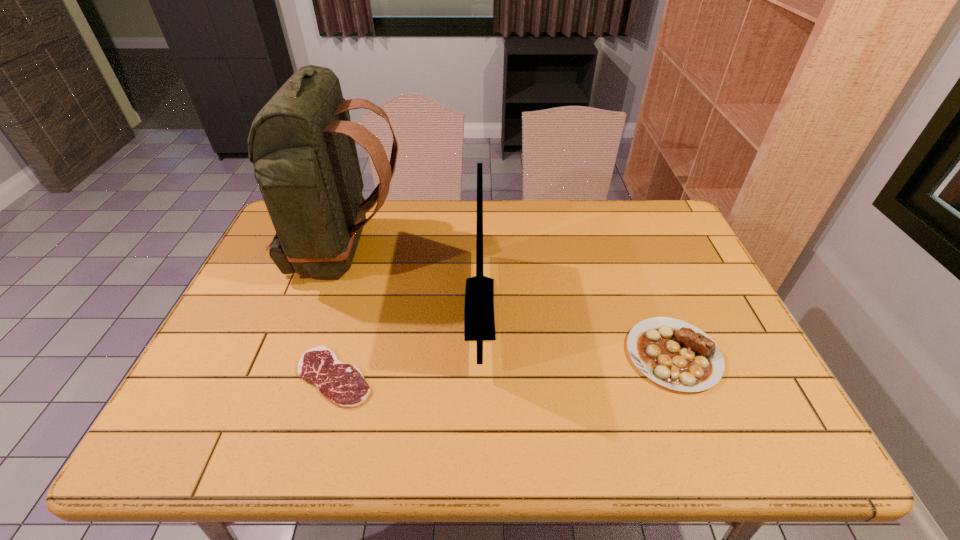
Identify which object is the third closest to the left steak. Please provide its 2D coordinates. Your answer should be formatted as a tuple, i.e. [(x, y)], where the tuple contains the x and y coordinates of a point satisfying the conditions above.

[(675, 354)]

Locate an element on the screen. Image resolution: width=960 pixels, height=540 pixels. vacant space that satisfies the following two spatial constraints: 1. on the front-facing side of the second tallest object; 2. on the right side of the right steak is located at coordinates (480, 355).

At what (x,y) coordinates should I click in order to perform the action: click on vacant region that satisfies the following two spatial constraints: 1. on the back of the shorter steak; 2. on the left side of the tallest object. Please return your answer as a coordinate pair (x, y). Image resolution: width=960 pixels, height=540 pixels. Looking at the image, I should click on (303, 377).

Locate an element on the screen. This screenshot has width=960, height=540. vacant space that satisfies the following two spatial constraints: 1. on the back side of the shortest object; 2. on the back of the tallest object is located at coordinates (371, 252).

Image resolution: width=960 pixels, height=540 pixels. Identify the location of vacant space that satisfies the following two spatial constraints: 1. on the front-facing side of the third object from left to right; 2. on the left side of the second shortest object. (480, 355).

Find the location of a particular element. Image resolution: width=960 pixels, height=540 pixels. vacant position in the image that satisfies the following two spatial constraints: 1. on the back of the right steak; 2. on the left side of the tallest object is located at coordinates (311, 355).

The width and height of the screenshot is (960, 540). What are the coordinates of `free space that satisfies the following two spatial constraints: 1. on the back side of the shortest object; 2. on the back of the tallest object` in the screenshot? It's located at (371, 252).